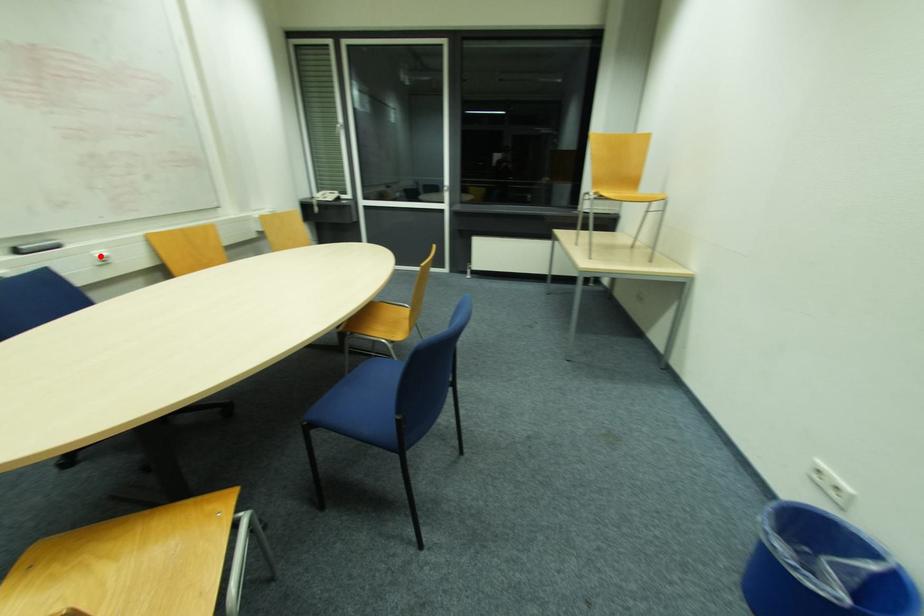
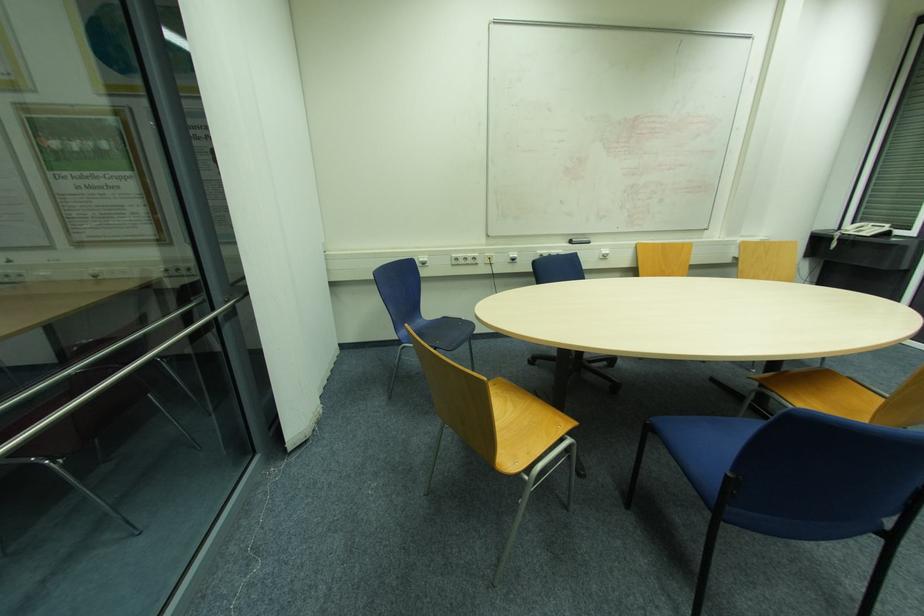
Question: I am providing you with two images of the same scene from different viewpoints. Given a red point in image1, look at the same physical point in image2. Is it:

Choices:
 (A) Closer to the viewpoint
 (B) Farther from the viewpoint

Answer: (A)